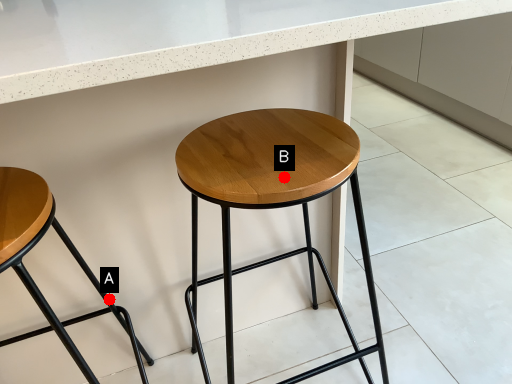
Question: Two points are circled on the image, labeled by A and B beside each circle. Which point appears closest to the camera in this image?

Choices:
 (A) A is closer
 (B) B is closer

Answer: (B)